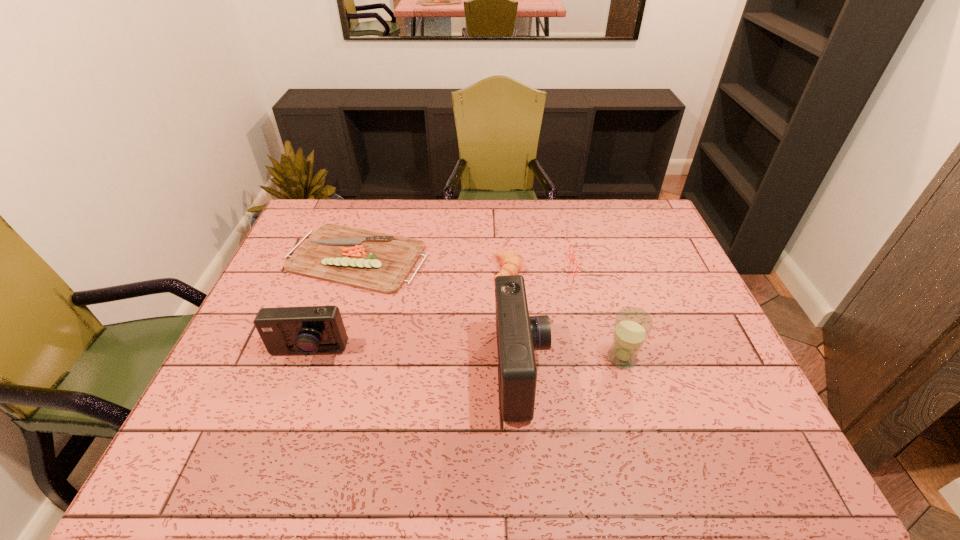
Identify the location of empty space between the glass and the right camera. This screenshot has width=960, height=540. click(x=571, y=364).

I want to click on vacant area between the glass and the spectacles, so coord(608,313).

The image size is (960, 540). I want to click on free space between the chopping board and the tallest object, so click(439, 314).

Where is `unoccupied area between the chopping board and the glass`? This screenshot has height=540, width=960. unoccupied area between the chopping board and the glass is located at coordinates (490, 308).

Locate an element on the screen. This screenshot has width=960, height=540. free space between the shortest object and the spectacles is located at coordinates (475, 262).

At what (x,y) coordinates should I click in order to perform the action: click on vacant space in between the left camera and the taller camera. Please return your answer as a coordinate pair (x, y). The width and height of the screenshot is (960, 540). Looking at the image, I should click on (414, 362).

Identify which object is the fourth nearest to the left camera. Please provide its 2D coordinates. Your answer should be formatted as a tuple, i.e. [(x, y)], where the tuple contains the x and y coordinates of a point satisfying the conditions above.

[(632, 326)]

In order to click on object that is the fourth closest to the taller camera in this screenshot , I will do `click(378, 262)`.